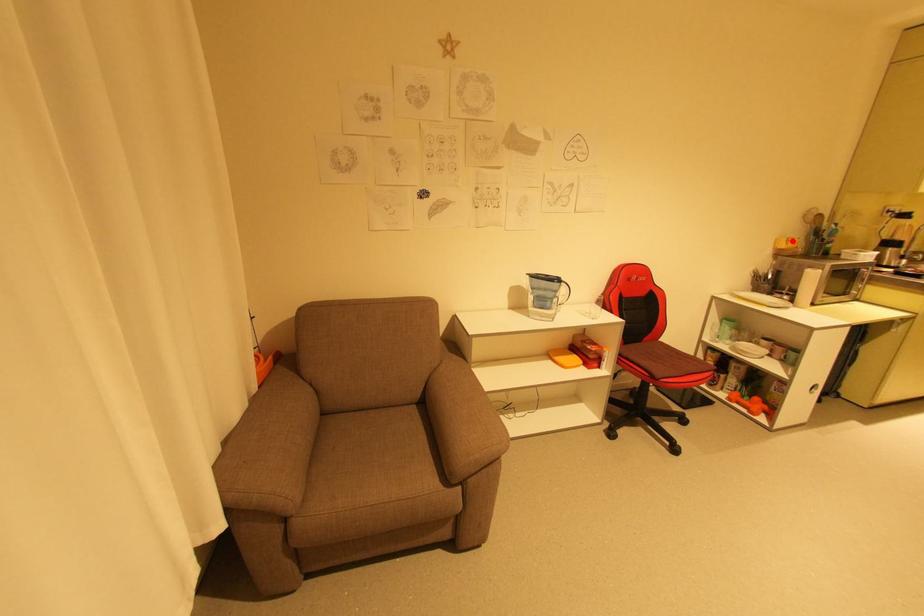
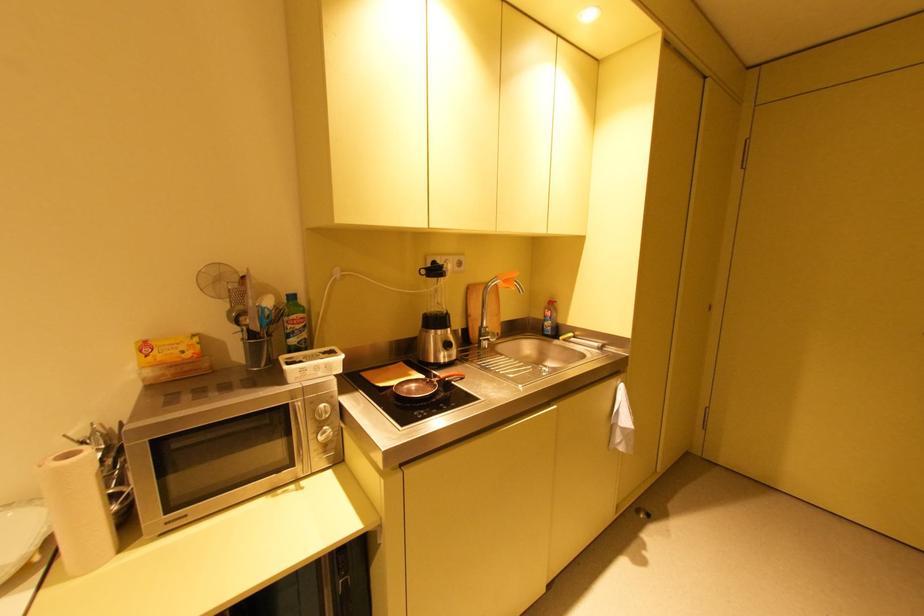
The point at the highlighted location is marked in the first image. Where is the corresponding point in the second image?

(150, 347)